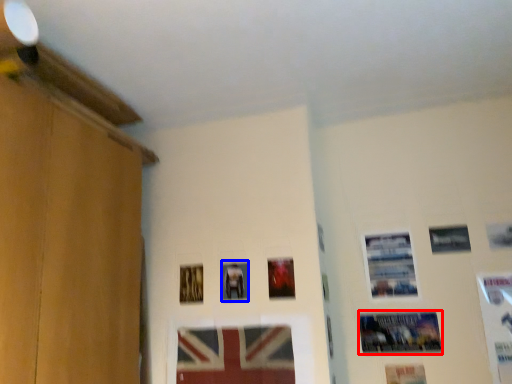
Question: Which object is closer to the camera taking this photo, picture frame (highlighted by a red box) or picture frame (highlighted by a blue box)?

Choices:
 (A) picture frame
 (B) picture frame

Answer: (A)